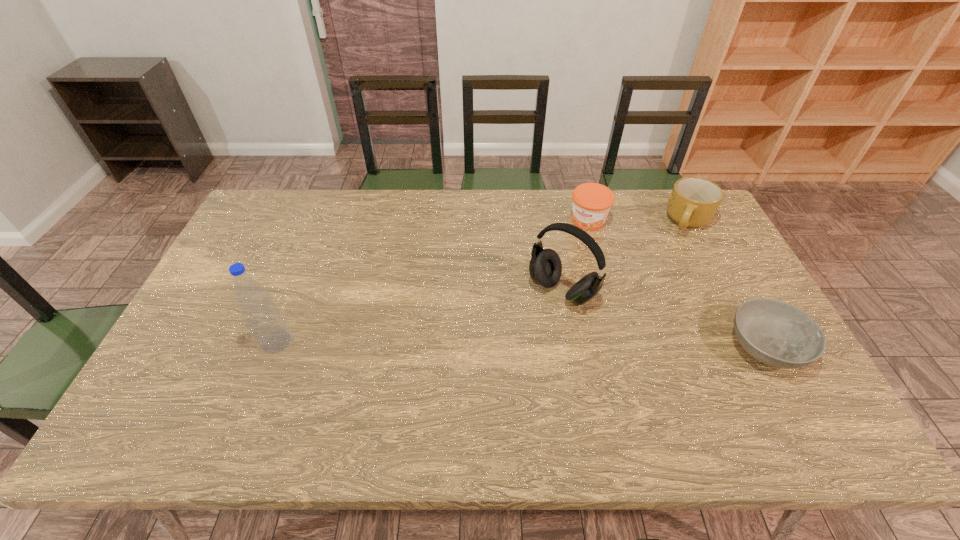
Where is `vacant point located between the second tallest object and the jam`? The image size is (960, 540). vacant point located between the second tallest object and the jam is located at coordinates (575, 255).

The image size is (960, 540). I want to click on vacant area that lies between the jam and the bowl, so click(x=677, y=284).

Find the location of a particular element. This screenshot has height=540, width=960. free point between the tallest object and the shortest object is located at coordinates (520, 344).

This screenshot has width=960, height=540. I want to click on free space between the bowl and the mug, so click(727, 284).

The width and height of the screenshot is (960, 540). Find the location of `free spot between the water bottle and the mug`. free spot between the water bottle and the mug is located at coordinates (482, 282).

Where is `free space between the jam and the mug`? Image resolution: width=960 pixels, height=540 pixels. free space between the jam and the mug is located at coordinates (638, 221).

Where is `free space between the headset and the mug`? The height and width of the screenshot is (540, 960). free space between the headset and the mug is located at coordinates (626, 256).

At what (x,y) coordinates should I click in order to perform the action: click on free space between the mug and the jam. Please return your answer as a coordinate pair (x, y). The width and height of the screenshot is (960, 540). Looking at the image, I should click on (638, 221).

This screenshot has height=540, width=960. Identify the location of blank region between the bowl and the headset. (664, 319).

Select which object appears as the closest to the headset. Please provide its 2D coordinates. Your answer should be formatted as a tuple, i.e. [(x, y)], where the tuple contains the x and y coordinates of a point satisfying the conditions above.

[(591, 202)]